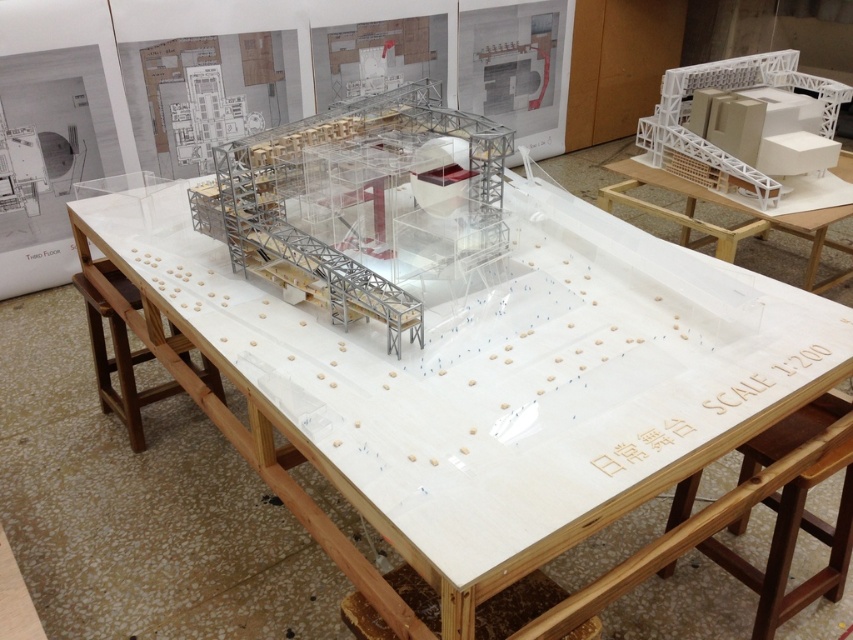
Is point (712, 422) behind point (730, 243)?

No, it is in front of (730, 243).

In the scene shown: Does white wood table at center appear on the left side of white matte table at upper right?

Yes, white wood table at center is to the left of white matte table at upper right.

Measure the distance between point (653, 243) and camera.

The distance of point (653, 243) from camera is 1.76 meters.

This screenshot has width=853, height=640. Identify the location of white wood table at center. (474, 401).

Does brown wood stool at lower right appear over white matte table at upper right?

No.

Looking at this image, can you confirm if brown wood stool at lower right is wider than white matte table at upper right?

Incorrect, brown wood stool at lower right's width does not surpass white matte table at upper right's.

The image size is (853, 640). What do you see at coordinates (793, 545) in the screenshot?
I see `brown wood stool at lower right` at bounding box center [793, 545].

You are a GUI agent. You are given a task and a screenshot of the screen. Output one action in this format:
    pyautogui.click(x=<x>, y=<y>)
    Task: Click on the brown wood stool at lower right
    The height and width of the screenshot is (640, 853).
    Given the screenshot: What is the action you would take?
    pyautogui.click(x=793, y=545)

Who is higher up, white wood table at center or brown wood stool at lower right?

white wood table at center is higher up.

Does white wood table at center lie behind brown wood stool at lower right?

No, it is in front of brown wood stool at lower right.

You are a GUI agent. You are given a task and a screenshot of the screen. Output one action in this format:
    pyautogui.click(x=<x>, y=<y>)
    Task: Click on the white wood table at center
    The width and height of the screenshot is (853, 640).
    Given the screenshot: What is the action you would take?
    pyautogui.click(x=474, y=401)

This screenshot has width=853, height=640. What are the coordinates of `white wood table at center` in the screenshot? It's located at (474, 401).